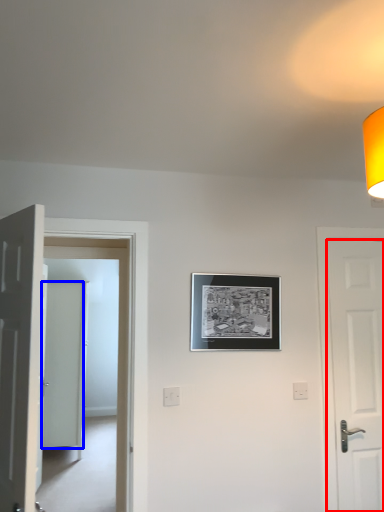
Question: Which object appears farthest to the camera in this image, door (highlighted by a red box) or door (highlighted by a blue box)?

Choices:
 (A) door
 (B) door

Answer: (B)